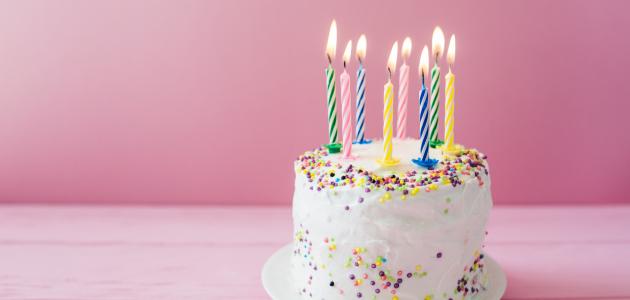
The width and height of the screenshot is (630, 300). I want to click on candle wick, so click(x=387, y=73), click(x=358, y=59), click(x=344, y=62), click(x=329, y=58), click(x=404, y=54), click(x=425, y=77), click(x=435, y=57), click(x=450, y=61).